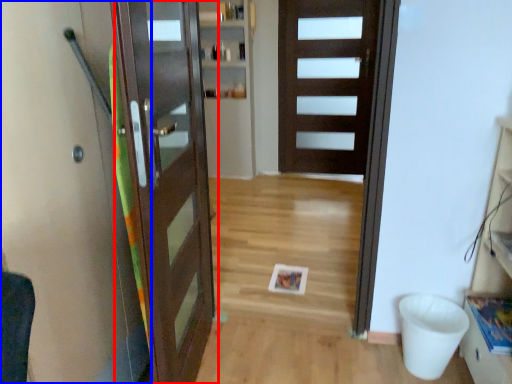
Question: Which object is closer to the camera taking this photo, door (highlighted by a red box) or elevator (highlighted by a blue box)?

Choices:
 (A) door
 (B) elevator

Answer: (B)